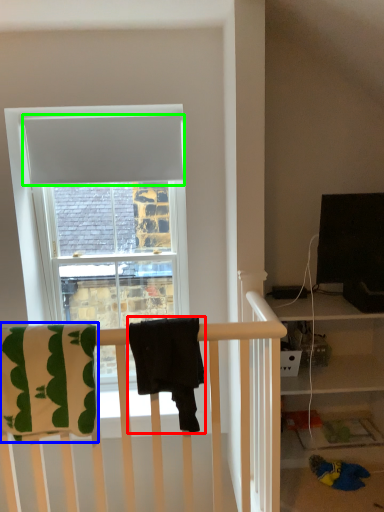
Question: Considering the real-world distances, which object is farthest from beach towel (highlighted by a red box)? beach towel (highlighted by a blue box) or curtain (highlighted by a green box)?

Choices:
 (A) beach towel
 (B) curtain

Answer: (B)